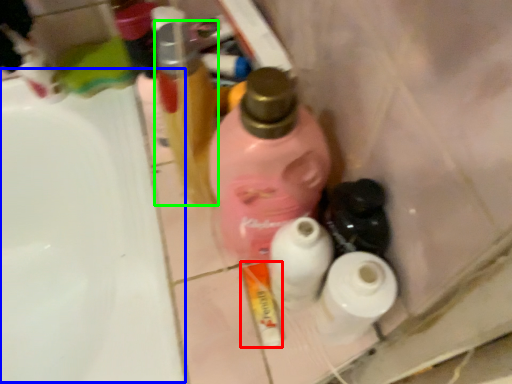
Question: Based on their relative distances, which object is nearer to toothpaste (highlighted by a red box)? Choose from sink (highlighted by a blue box) and bottle (highlighted by a green box).

Choices:
 (A) sink
 (B) bottle

Answer: (B)